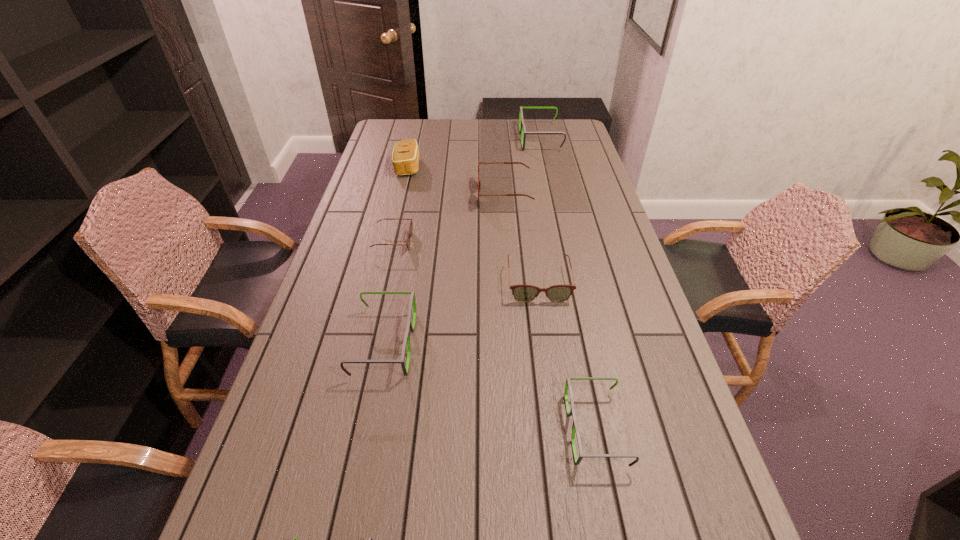
You are a GUI agent. You are given a task and a screenshot of the screen. Output one action in this format:
    pyautogui.click(x=<x>, y=<y>)
    Task: Click on the seventh closest object to the smallest black spectacles
    The width and height of the screenshot is (960, 540).
    Given the screenshot: What is the action you would take?
    pyautogui.click(x=522, y=129)

This screenshot has height=540, width=960. In order to click on object that is the fourth closest to the brown clutch bag in this screenshot , I will do `click(523, 293)`.

The height and width of the screenshot is (540, 960). Identify the location of spectacles that is the fourth closest one to the biggest brown spectacles. (410, 327).

Locate an element on the screen. Image resolution: width=960 pixels, height=540 pixels. the fourth closest spectacles relative to the farthest brown spectacles is located at coordinates (410, 327).

Identify which black spectacles is located as the nearest to the second biggest brown spectacles. Please provide its 2D coordinates. Your answer should be formatted as a tuple, i.e. [(x, y)], where the tuple contains the x and y coordinates of a point satisfying the conditions above.

[(410, 327)]

Select which black spectacles appears as the third closest to the nearest spectacles. Please provide its 2D coordinates. Your answer should be formatted as a tuple, i.e. [(x, y)], where the tuple contains the x and y coordinates of a point satisfying the conditions above.

[(522, 129)]

Locate an element on the screen. This screenshot has width=960, height=540. the second closest brown spectacles relative to the biggest brown spectacles is located at coordinates (523, 293).

Select which brown spectacles appears as the closest to the second farthest object. Please provide its 2D coordinates. Your answer should be formatted as a tuple, i.e. [(x, y)], where the tuple contains the x and y coordinates of a point satisfying the conditions above.

[(479, 182)]

Locate an element on the screen. vacant region that satisfies the following two spatial constraints: 1. on the lens of the farthest black spectacles; 2. at the front view of the second biggest brown spectacles is located at coordinates (571, 283).